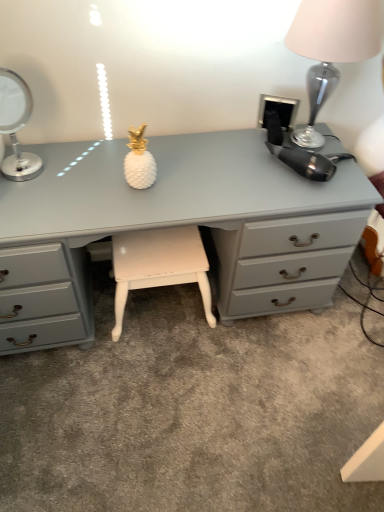
Question: Is matte gray desk at center taller or shorter than silver metallic table lamp at left, marked as the second table lamp in a right-to-left arrangement?

Choices:
 (A) tall
 (B) short

Answer: (A)

Question: Considering their positions, is matte gray desk at center located in front of or behind silver metallic table lamp at left, marked as the second table lamp in a right-to-left arrangement?

Choices:
 (A) front
 (B) behind

Answer: (B)

Question: Considering the real-world distances, which object is closest to the metallic silver table lamp at upper right, which appears as the first table lamp when viewed from the right?

Choices:
 (A) silver metallic table lamp at left, marked as the second table lamp in a right-to-left arrangement
 (B) matte gray desk at center
 (C) white painted wood stool at center

Answer: (B)

Question: Estimate the real-world distances between objects in this image. Which object is farther from the metallic silver table lamp at upper right, the 2th table lamp from the left?

Choices:
 (A) matte gray desk at center
 (B) white painted wood stool at center
 (C) silver metallic table lamp at left, which appears as the 1th table lamp when viewed from the left

Answer: (C)